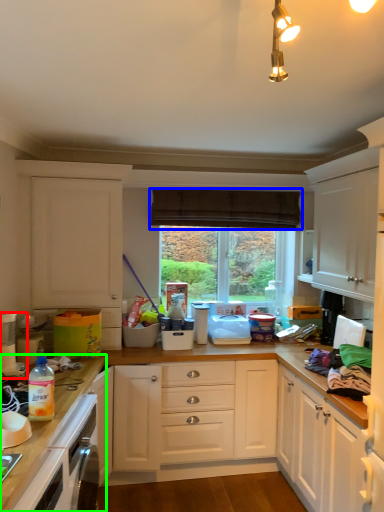
Question: Which object is the farthest from kitchen appliance (highlighted by a red box)? Choose among these: curtain (highlighted by a blue box) or countertop (highlighted by a green box).

Choices:
 (A) curtain
 (B) countertop

Answer: (A)